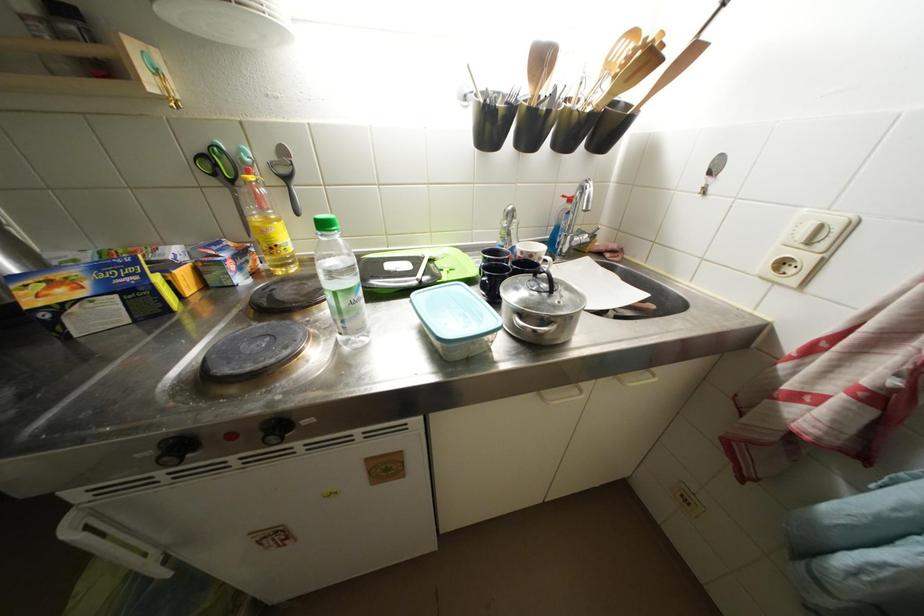
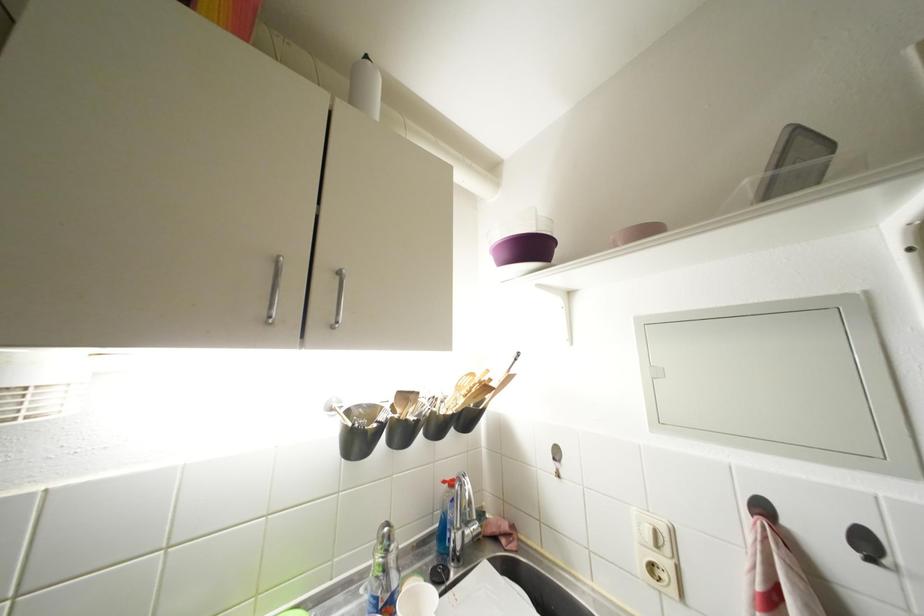
In the second image, find the point that corresponds to point (641, 37) in the first image.

(479, 379)